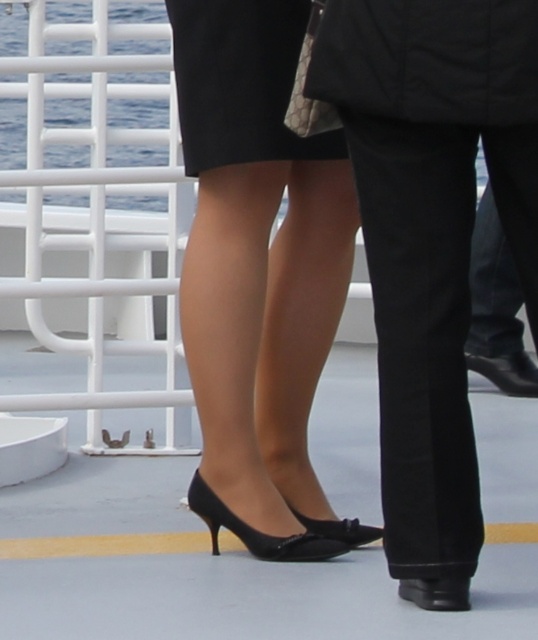
Based on the scene description, which object is wider, the black satin dress at center or the black patent leather heels at center?

The black satin dress at center is wider than the black patent leather heels at center according to the description.